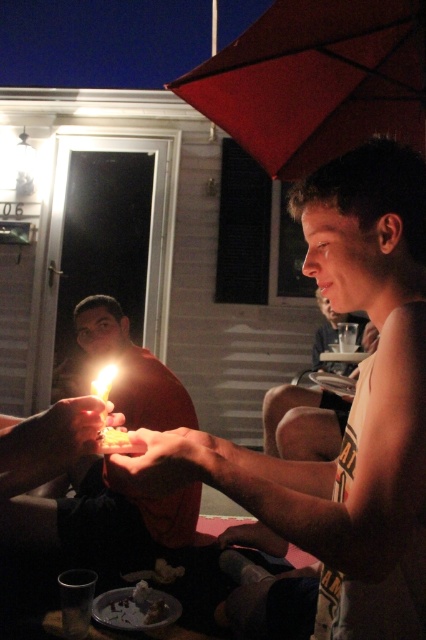
Question: Does matte black cake at center appear on the left side of smooth skin face at center?

Choices:
 (A) yes
 (B) no

Answer: (A)

Question: Is smooth skin face at center behind translucent yellow candle at center?

Choices:
 (A) no
 (B) yes

Answer: (B)

Question: Is smooth skin face at center below translucent yellow candle at center?

Choices:
 (A) yes
 (B) no

Answer: (A)

Question: Which point appears closest to the camera in this image?

Choices:
 (A) (279, 435)
 (B) (319, 17)
 (C) (363, 440)

Answer: (C)

Question: Which of the following is the farthest from the observer?

Choices:
 (A) (238, 56)
 (B) (403, 452)

Answer: (A)

Question: Which object is positioned closest to the matte red umbrella at upper center?

Choices:
 (A) matte black cake at center
 (B) matte red shirt at center
 (C) translucent yellow candle at center
 (D) smooth skin face at center

Answer: (D)